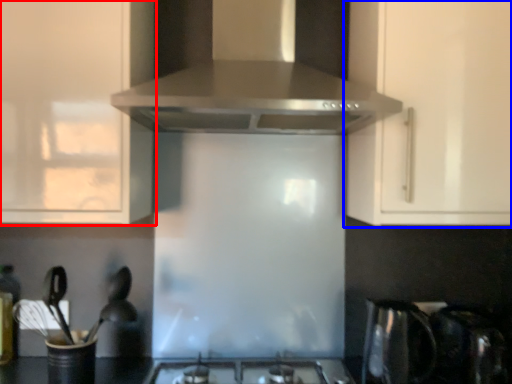
Question: Among these objects, which one is nearest to the camera, cabinetry (highlighted by a red box) or cabinetry (highlighted by a blue box)?

Choices:
 (A) cabinetry
 (B) cabinetry

Answer: (A)